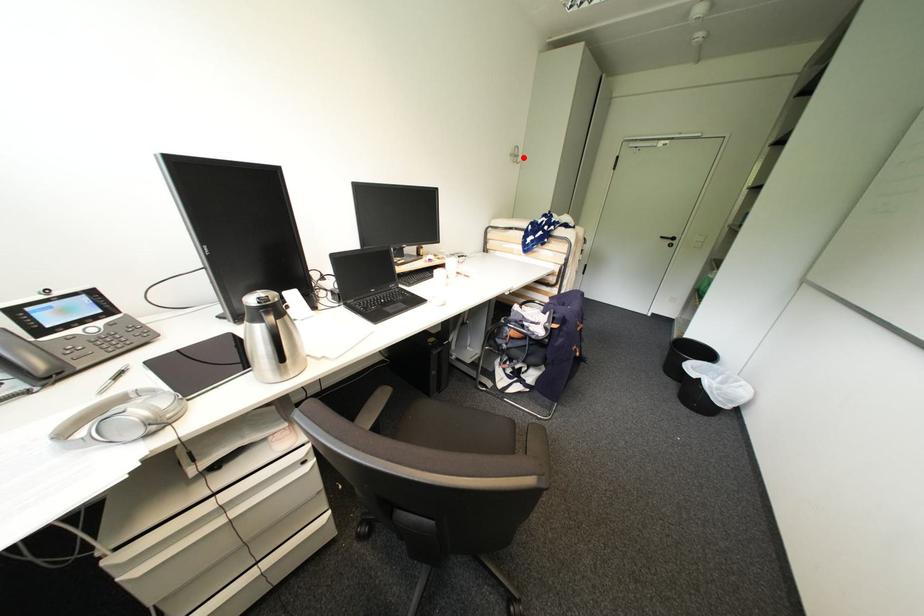
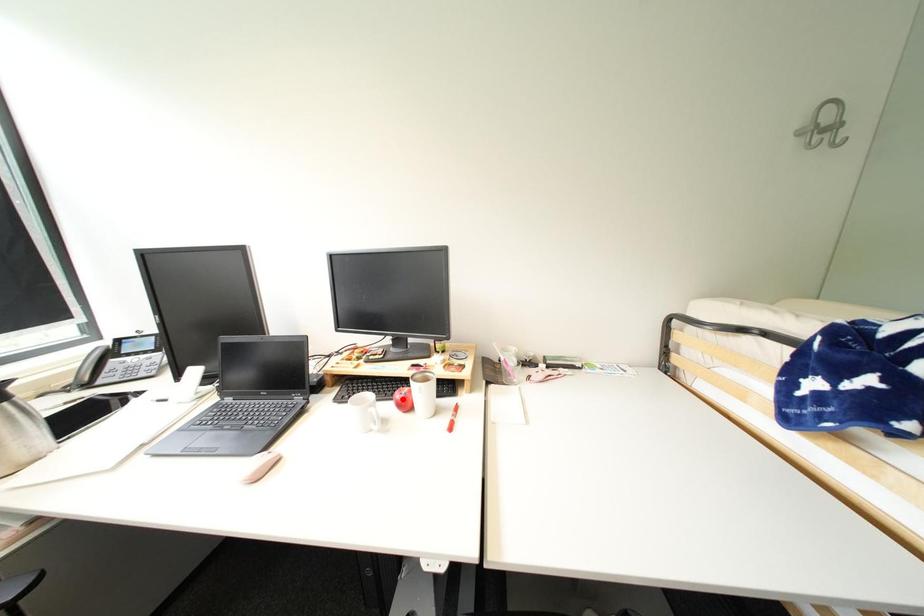
I am providing you with two images of the same scene from different viewpoints. A red point is marked on the first image and another point is marked on the second image. Are the points marked in image1 and image2 representing the same 3D position?

No